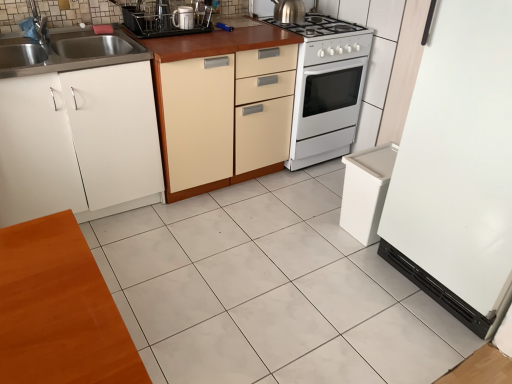
I want to click on vacant area to the right of white glossy coffee maker at center, which appears as the second kitchen appliance when viewed from the right, so click(211, 35).